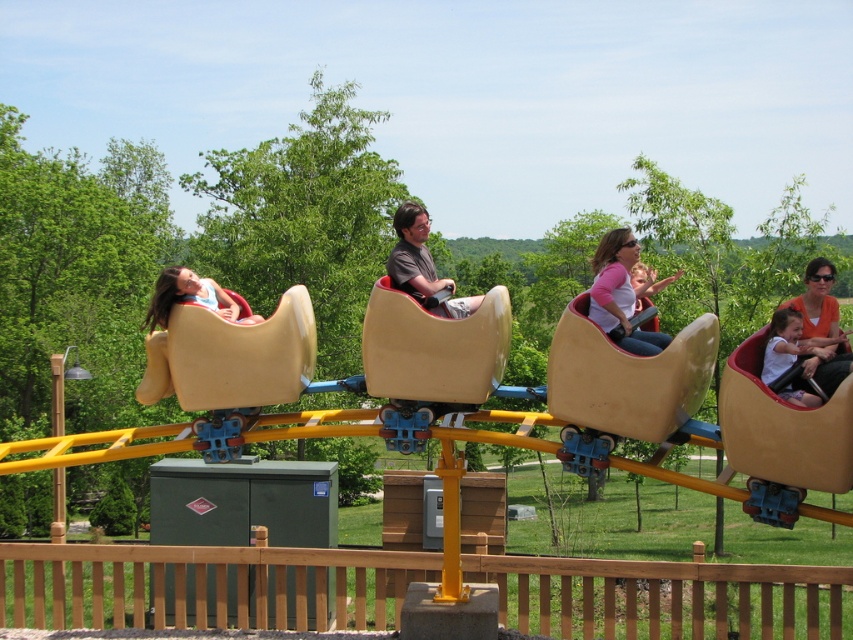
Does orange cotton shirt at center have a greater width compared to matte brown helmet at center?

Yes, orange cotton shirt at center is wider than matte brown helmet at center.

In the scene shown: Is orange cotton shirt at center to the left of matte brown helmet at center from the viewer's perspective?

No, orange cotton shirt at center is not to the left of matte brown helmet at center.

You are a GUI agent. You are given a task and a screenshot of the screen. Output one action in this format:
    pyautogui.click(x=<x>, y=<y>)
    Task: Click on the orange cotton shirt at center
    The image size is (853, 640).
    Given the screenshot: What is the action you would take?
    pyautogui.click(x=822, y=323)

Is pink matte shirt at center further to the viewer compared to matte brown helmet at center?

That is False.

You are a GUI agent. You are given a task and a screenshot of the screen. Output one action in this format:
    pyautogui.click(x=<x>, y=<y>)
    Task: Click on the pink matte shirt at center
    The height and width of the screenshot is (640, 853).
    Given the screenshot: What is the action you would take?
    pyautogui.click(x=621, y=292)

Describe the element at coordinates (621, 292) in the screenshot. The width and height of the screenshot is (853, 640). I see `pink matte shirt at center` at that location.

Identify the location of pink matte shirt at center. click(x=621, y=292).

Who is positioned more to the right, wooden fence at lower center or pink matte shirt at center?

pink matte shirt at center is more to the right.

Does wooden fence at lower center have a lesser height compared to pink matte shirt at center?

Incorrect, wooden fence at lower center's height does not fall short of pink matte shirt at center's.

Does point (386, 596) come farther from viewer compared to point (651, 282)?

That is True.

Locate an element on the screen. wooden fence at lower center is located at coordinates (206, 586).